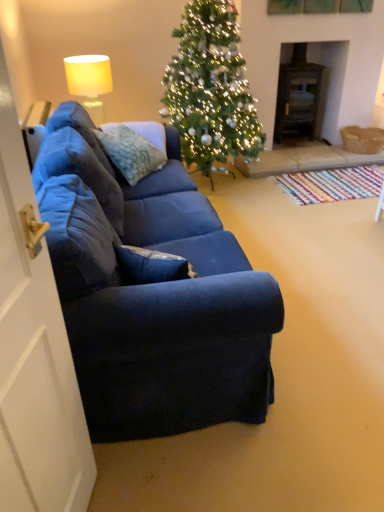
I want to click on free space to the back side of white matte door at left, so click(121, 456).